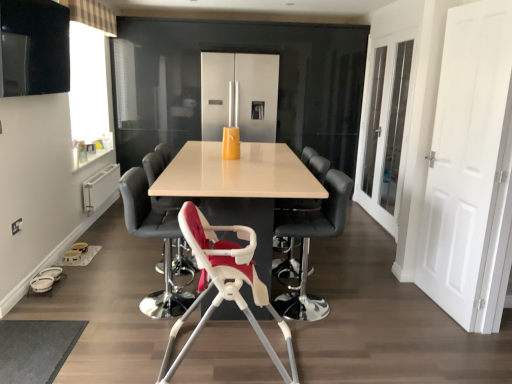
Locate an element on the screen. This screenshot has height=384, width=512. vacant space in between white matte door at right and black leather bar stool at center, placed as the third chair when sorted from front to back is located at coordinates (384, 304).